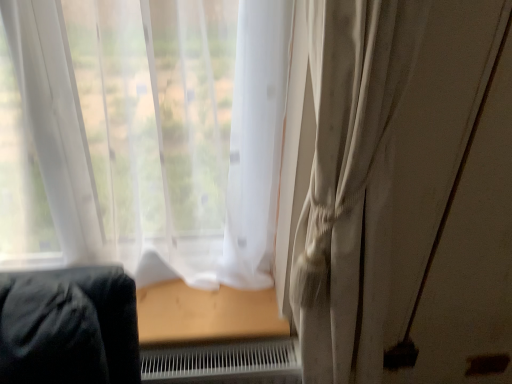
The height and width of the screenshot is (384, 512). What do you see at coordinates (399, 191) in the screenshot?
I see `satin beige curtain at right` at bounding box center [399, 191].

Where is `satin beige curtain at right`? Image resolution: width=512 pixels, height=384 pixels. satin beige curtain at right is located at coordinates (399, 191).

In order to click on satin beige curtain at right in this screenshot , I will do `click(399, 191)`.